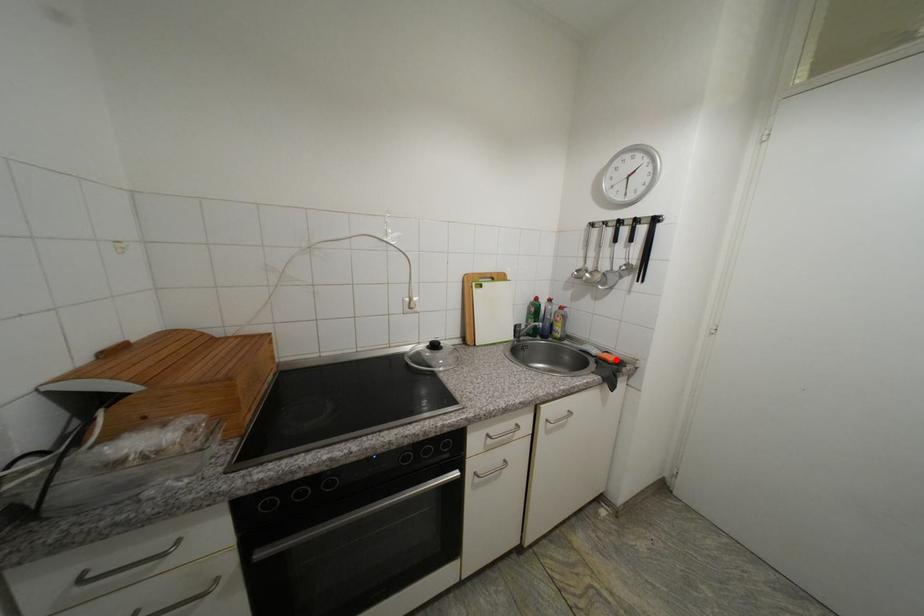
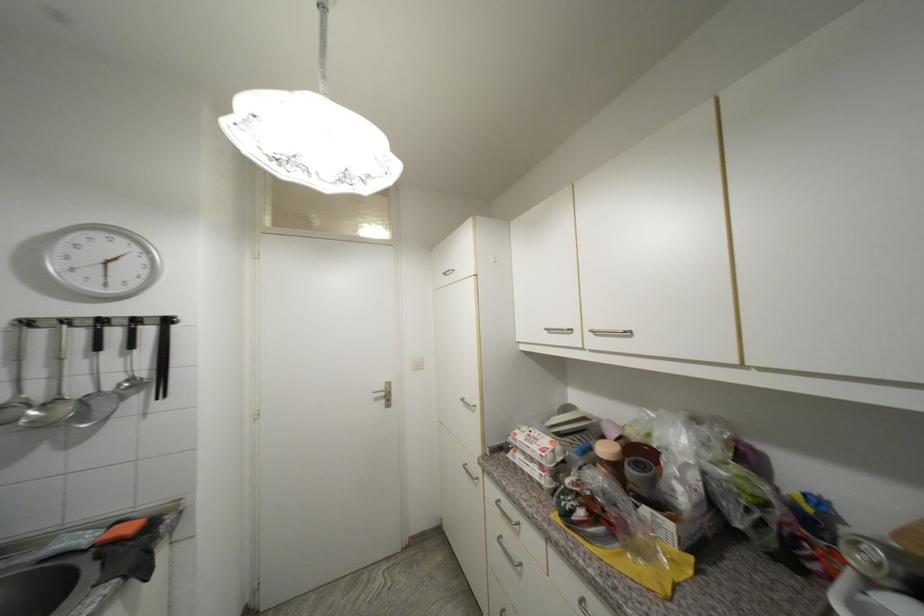
In the second image, find the point that corresponds to the highlighted location in the first image.

(137, 530)